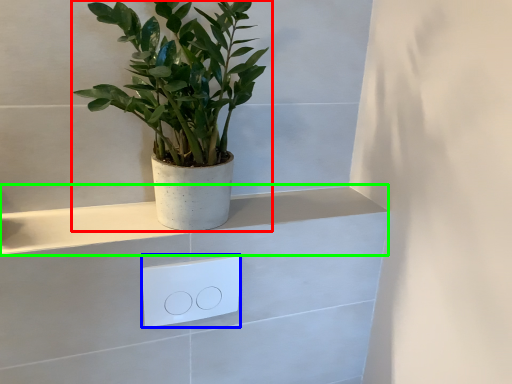
Question: Estimate the real-world distances between objects in this image. Which object is closer to houseplant (highlighted by a red box), light switch (highlighted by a blue box) or ledge (highlighted by a green box)?

Choices:
 (A) light switch
 (B) ledge

Answer: (B)